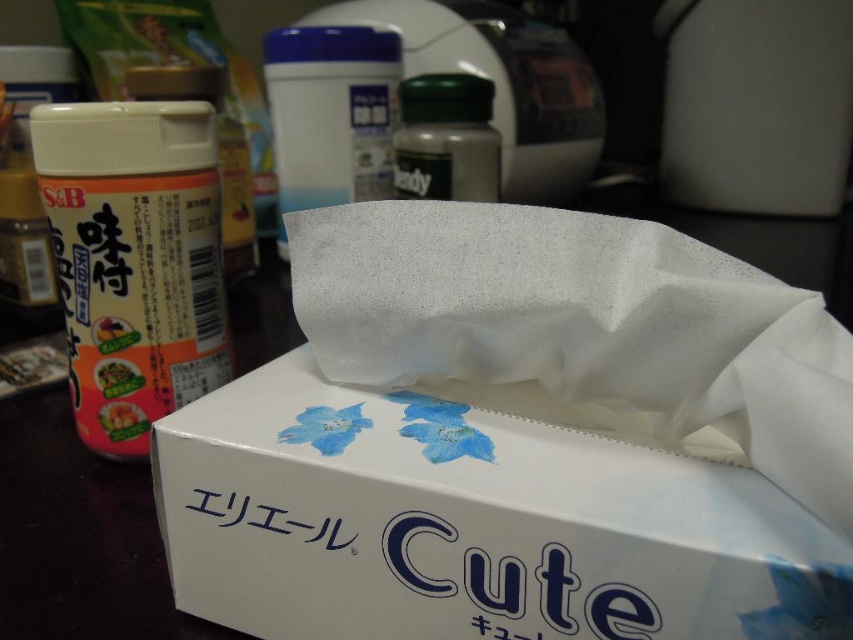
Question: Which point is closer to the camera?

Choices:
 (A) matte plastic spice container at left
 (B) white paper tissue at center
 (C) orange matte seasoning at left

Answer: (B)

Question: Is white cardboard box at center positioned behind green matte bottle at center?

Choices:
 (A) no
 (B) yes

Answer: (A)

Question: Among these points, which one is nearest to the camera?

Choices:
 (A) (170, 182)
 (B) (611, 563)

Answer: (B)

Question: Does blue plastic container at center appear on the right side of orange matte seasoning at left?

Choices:
 (A) no
 (B) yes

Answer: (B)

Question: Considering the real-world distances, which object is closest to the white cardboard box at center?

Choices:
 (A) matte plastic spice container at left
 (B) orange matte seasoning at left
 (C) green matte bottle at center

Answer: (A)

Question: Can you confirm if matte plastic spice container at left is positioned to the left of green matte bottle at center?

Choices:
 (A) yes
 (B) no

Answer: (A)